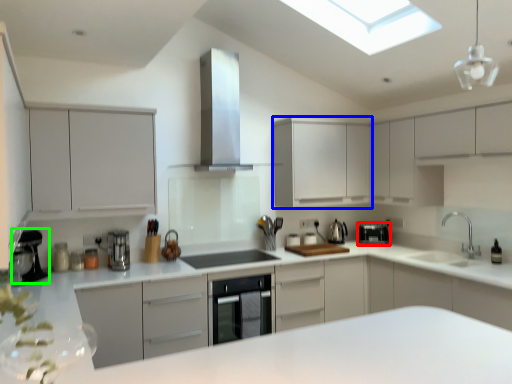
Question: Which object is positioned closest to kitchen appliance (highlighted by a red box)? Select from cabinetry (highlighted by a blue box) and coffee machine (highlighted by a green box).

Choices:
 (A) cabinetry
 (B) coffee machine

Answer: (A)